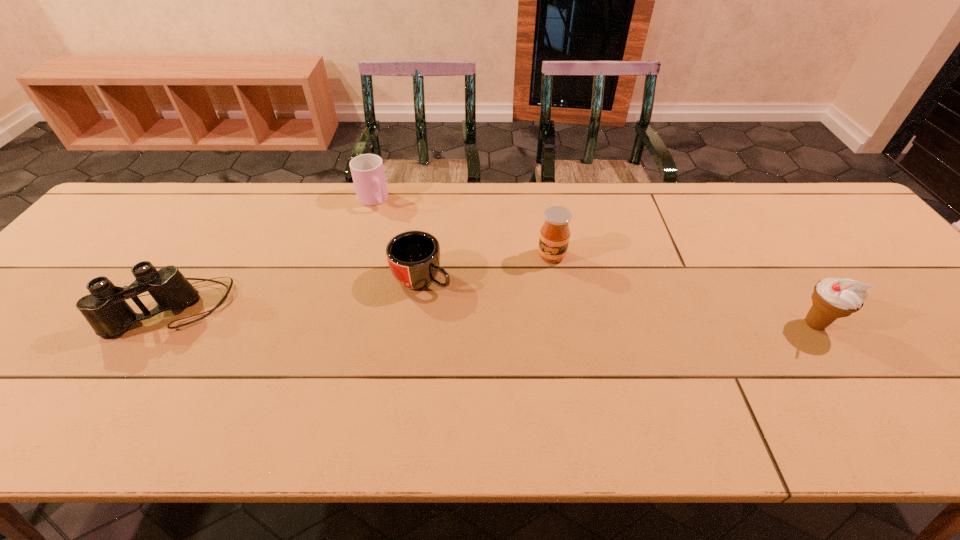
Locate an element on the screen. The image size is (960, 540). vacant region located 0.390m on the side of the mug with the handle is located at coordinates (587, 369).

Locate an element on the screen. vacant region located 0.200m on the side of the mug with the handle is located at coordinates [x=513, y=327].

In order to click on free space located with the handle on the side of the cup in this screenshot , I will do `click(410, 242)`.

Locate an element on the screen. vacant area situated 0.400m with the handle on the side of the cup is located at coordinates (453, 291).

Image resolution: width=960 pixels, height=540 pixels. In order to click on vacant space located with the handle on the side of the cup in this screenshot , I will do coord(451,288).

Locate an element on the screen. vacant region located 0.050m on the front-facing side of the honey is located at coordinates (545, 279).

Identify the location of vacant space located 0.100m on the front-facing side of the honey. (540, 292).

Identify the location of vacant space situated on the front-facing side of the honey. (535, 313).

Identify the location of object that is at the far edge. (367, 170).

This screenshot has height=540, width=960. I want to click on vacant region at the far edge of the desktop, so click(320, 201).